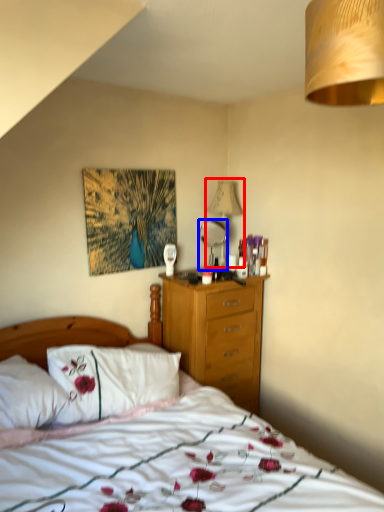
Question: Which object is closer to the camera taking this photo, lamp (highlighted by a red box) or mirror (highlighted by a blue box)?

Choices:
 (A) lamp
 (B) mirror

Answer: (B)